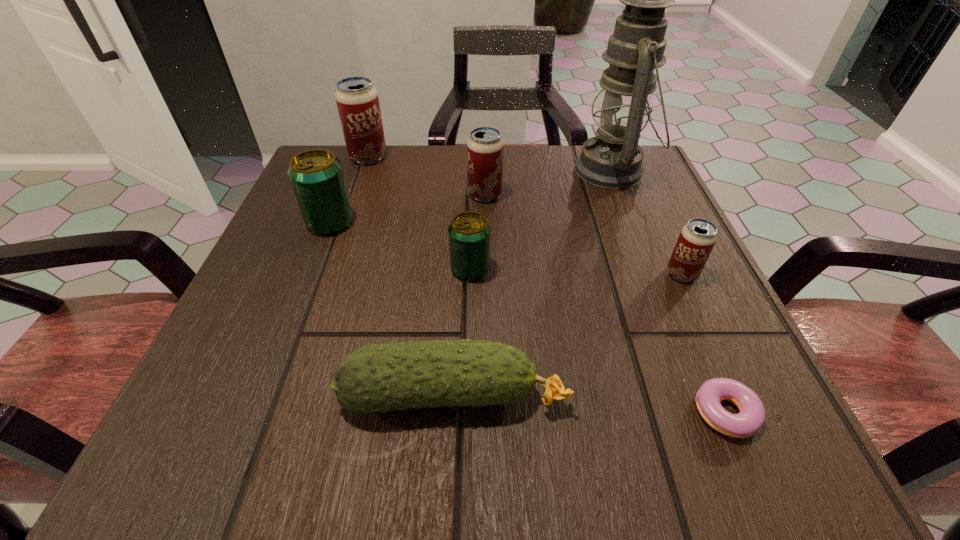
This screenshot has width=960, height=540. I want to click on the smaller green beer can, so click(469, 232).

Locate an element on the screen. the second shortest object is located at coordinates (390, 376).

Image resolution: width=960 pixels, height=540 pixels. I want to click on cucumber, so click(390, 376).

The height and width of the screenshot is (540, 960). Identify the location of the shortest object. (751, 417).

At what (x,y) coordinates should I click in order to perform the action: click on purple doughnut. Please return your answer as a coordinate pair (x, y). Image resolution: width=960 pixels, height=540 pixels. Looking at the image, I should click on (751, 417).

Image resolution: width=960 pixels, height=540 pixels. In order to click on vacant space located 0.330m on the left of the oil lamp in this screenshot , I will do `click(422, 170)`.

You are a GUI agent. You are given a task and a screenshot of the screen. Output one action in this format:
    pyautogui.click(x=<x>, y=<y>)
    Task: Click on the vacant space located 0.090m on the front of the biggest red beer can
    This screenshot has width=960, height=540.
    Given the screenshot: What is the action you would take?
    pyautogui.click(x=357, y=190)

The width and height of the screenshot is (960, 540). Find the location of `free spot located 0.300m on the left of the fourth nearest beer can`. free spot located 0.300m on the left of the fourth nearest beer can is located at coordinates 320,194.

Where is `vacant space positioned on the front of the third farthest beer can`? This screenshot has height=540, width=960. vacant space positioned on the front of the third farthest beer can is located at coordinates (261, 403).

You are a GUI agent. You are given a task and a screenshot of the screen. Output one action in this format:
    pyautogui.click(x=<x>, y=<y>)
    Task: Click on the free space located on the front of the rightmost beer can
    The height and width of the screenshot is (540, 960).
    Given the screenshot: What is the action you would take?
    pyautogui.click(x=698, y=308)